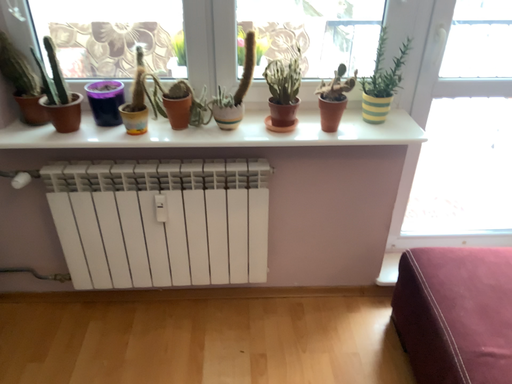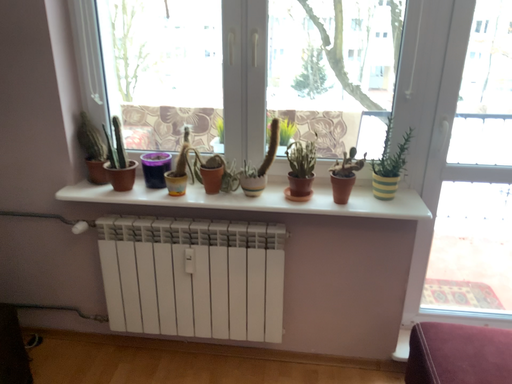
Question: How did the camera likely rotate when shooting the video?

Choices:
 (A) rotated left
 (B) rotated right

Answer: (A)